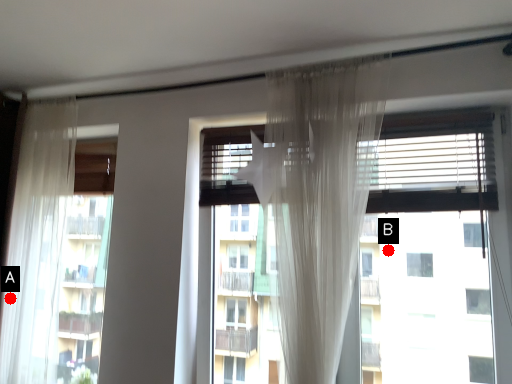
Question: Two points are circled on the image, labeled by A and B beside each circle. Which point is closer to the camera?

Choices:
 (A) A is closer
 (B) B is closer

Answer: (B)